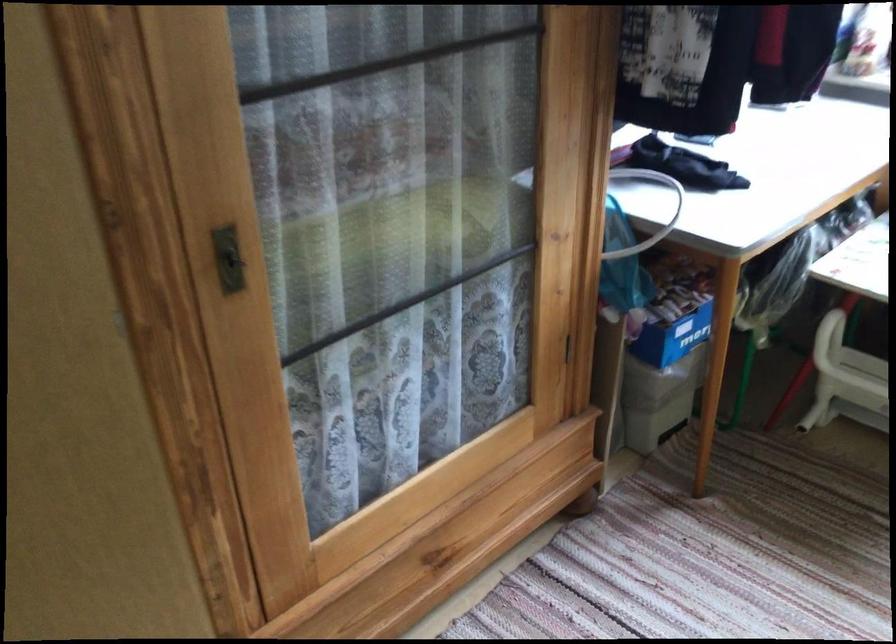
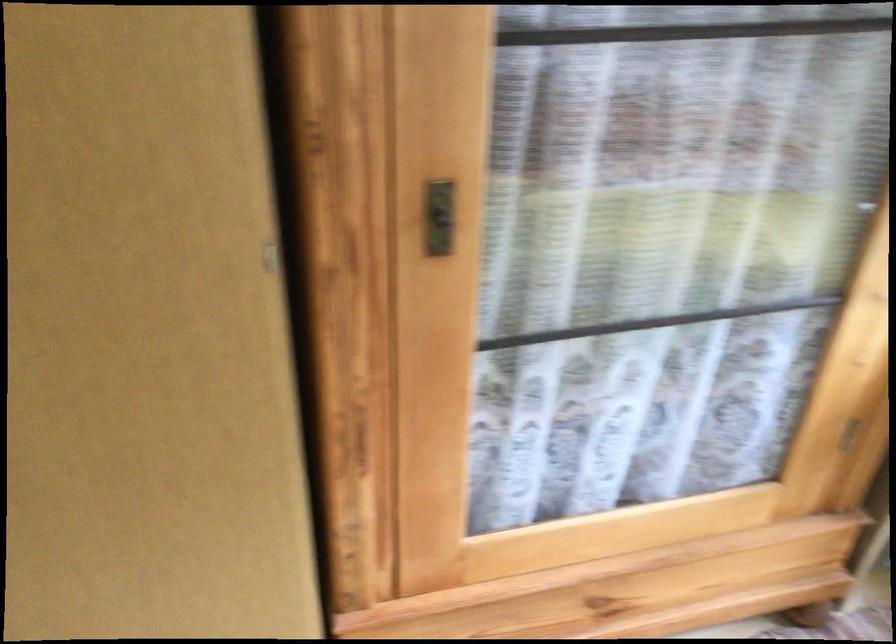
Find the pixel in the second image that matches point (225, 252) in the first image.

(438, 218)